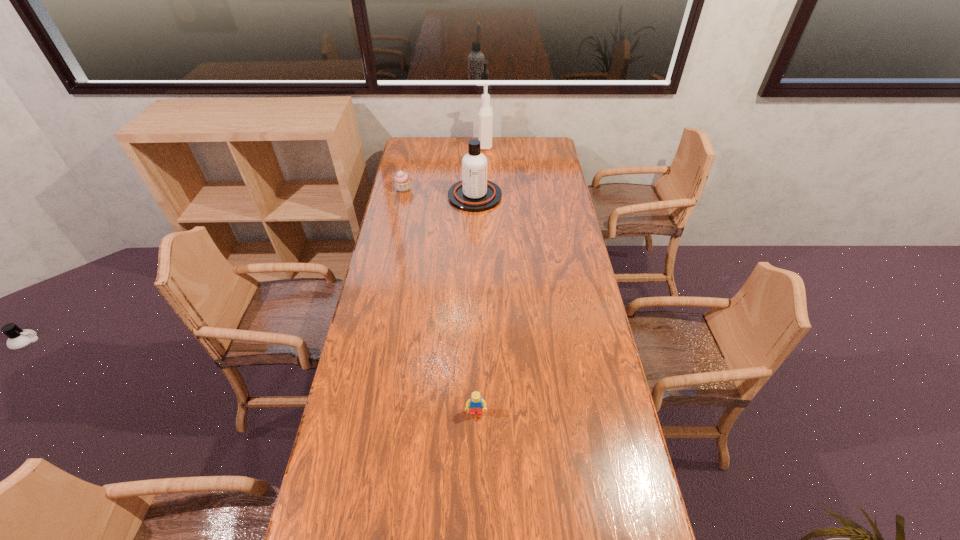
You are a GUI agent. You are given a task and a screenshot of the screen. Output one action in this format:
    pyautogui.click(x=<x>, y=<y>)
    Task: Click on the free region located 0.170m on the right of the cupcake
    
    Given the screenshot: What is the action you would take?
    pyautogui.click(x=447, y=189)

In order to click on vacant area situated on the front-facing side of the nearest object in this screenshot , I will do `click(476, 441)`.

What are the coordinates of `object located in the far edge section of the desktop` in the screenshot? It's located at (485, 111).

You are a GUI agent. You are given a task and a screenshot of the screen. Output one action in this format:
    pyautogui.click(x=<x>, y=<y>)
    Task: Click on the object that is at the left edge
    
    Given the screenshot: What is the action you would take?
    pyautogui.click(x=402, y=180)

Find the location of a particular element. vacant space at the far edge of the desktop is located at coordinates (498, 145).

Image resolution: width=960 pixels, height=540 pixels. I want to click on free space at the left edge, so click(x=402, y=326).

In the image, there is a desktop. At what (x,y) coordinates should I click in order to perform the action: click on vacant space at the right edge. Please return your answer as a coordinate pair (x, y). Looking at the image, I should click on click(x=550, y=226).

The width and height of the screenshot is (960, 540). Find the location of `vacant space at the far left corner`. vacant space at the far left corner is located at coordinates (423, 151).

Identify the location of vacant space at the far right corner of the desktop. (545, 137).

Find the location of a particular element. The height and width of the screenshot is (540, 960). unoccupied area between the shorter cleansing agent and the cupcake is located at coordinates (439, 192).